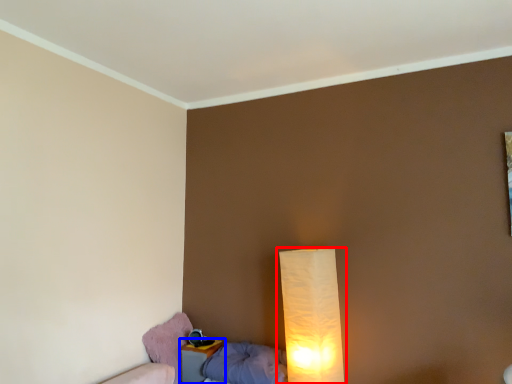
Question: Among these objects, which one is farthest to the camera, lamp (highlighted by a red box) or nightstand (highlighted by a blue box)?

Choices:
 (A) lamp
 (B) nightstand

Answer: (B)